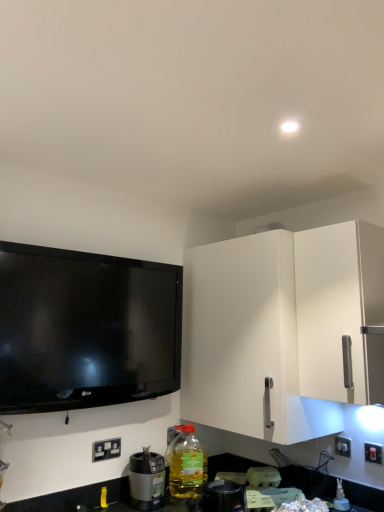
Question: Are translucent plastic bottle at lower center and metallic silver blender at lower center, the 2th appliance from the left, located far from each other?

Choices:
 (A) yes
 (B) no

Answer: (B)

Question: Does translucent plastic bottle at lower center appear on the left side of metallic silver blender at lower center, positioned as the first appliance in front-to-back order?

Choices:
 (A) no
 (B) yes

Answer: (B)

Question: From a real-world perspective, is translucent plastic bottle at lower center over metallic silver blender at lower center, placed as the 1th appliance when sorted from right to left?

Choices:
 (A) no
 (B) yes

Answer: (B)

Question: Is translucent plastic bottle at lower center surrounding metallic silver blender at lower center, the 2th appliance when ordered from back to front?

Choices:
 (A) no
 (B) yes

Answer: (A)

Question: Is translucent plastic bottle at lower center located outside metallic silver blender at lower center, positioned as the first appliance in front-to-back order?

Choices:
 (A) no
 (B) yes

Answer: (B)

Question: Is translucent plastic bottle at lower center closer to the viewer compared to metallic silver blender at lower center, the 2th appliance from the left?

Choices:
 (A) yes
 (B) no

Answer: (B)

Question: Considering the relative sizes of black plastic blender at lower left, the second appliance when ordered from front to back, and white plastic switch at lower right, which is counted as the second electric outlet, starting from the left, in the image provided, is black plastic blender at lower left, the second appliance when ordered from front to back, shorter than white plastic switch at lower right, which is counted as the second electric outlet, starting from the left,?

Choices:
 (A) yes
 (B) no

Answer: (B)

Question: Does black plastic blender at lower left, the second appliance when ordered from front to back, lie in front of white plastic switch at lower right, which is counted as the second electric outlet, starting from the left?

Choices:
 (A) yes
 (B) no

Answer: (A)

Question: Can you confirm if black plastic blender at lower left, which is the 2th appliance from right to left, is smaller than white plastic switch at lower right, the first electric outlet in the right-to-left sequence?

Choices:
 (A) no
 (B) yes

Answer: (A)

Question: Considering the relative sizes of black plastic blender at lower left, acting as the 1th appliance starting from the left, and white plastic switch at lower right, the first electric outlet in the right-to-left sequence, in the image provided, is black plastic blender at lower left, acting as the 1th appliance starting from the left, bigger than white plastic switch at lower right, the first electric outlet in the right-to-left sequence,?

Choices:
 (A) no
 (B) yes

Answer: (B)

Question: Could you tell me if black plastic blender at lower left, the second appliance when ordered from front to back, is facing white plastic switch at lower right, the first electric outlet in the right-to-left sequence?

Choices:
 (A) yes
 (B) no

Answer: (B)

Question: Would you consider black plastic blender at lower left, the 1th appliance positioned from the back, to be distant from white plastic switch at lower right, the first electric outlet in the right-to-left sequence?

Choices:
 (A) no
 (B) yes

Answer: (A)

Question: From the image's perspective, is white plastic electrical outlet at lower left, acting as the first electric outlet starting from the left, on white matte cabinet at right?

Choices:
 (A) yes
 (B) no

Answer: (B)